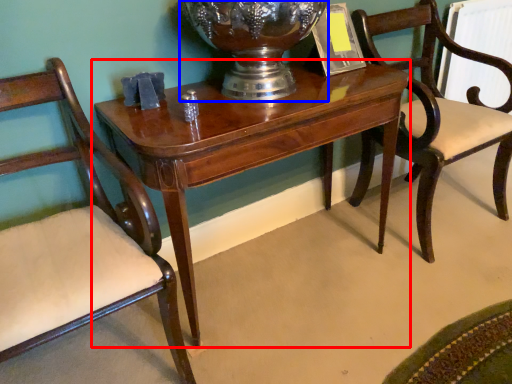
Question: Which object is further to the camera taking this photo, table (highlighted by a red box) or glass vase (highlighted by a blue box)?

Choices:
 (A) table
 (B) glass vase

Answer: (B)